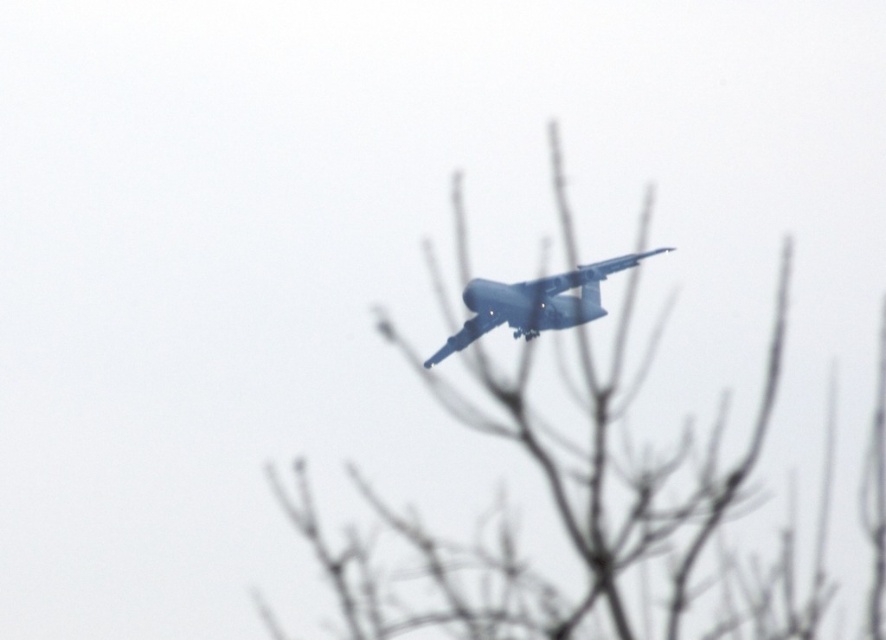
You are a pilot flying a small drone that needs to navigate between the bare branches at center and the matte blue airplane at center. Which object has a wider width to allow the drone to pass safely?

The bare branches at center has a larger width than the matte blue airplane at center, so the drone should pass through the bare branches at center to ensure safe passage.

You are a pilot flying the matte blue airplane at center. You notice that the bare branches at center are blocking your view. Can you safely maneuver around them without hitting them?

The bare branches at center are much taller than the matte blue airplane at center, so you cannot safely maneuver around them without risking a collision. You should adjust your flight path to avoid the area with the tall branches.

You are a drone operator trying to navigate between two points in the image. The first point is point [636,259] and the second is point [566,276]. Which point is closer to the camera?

Point [566,276] is closer to the camera because point [636,259] is behind it.